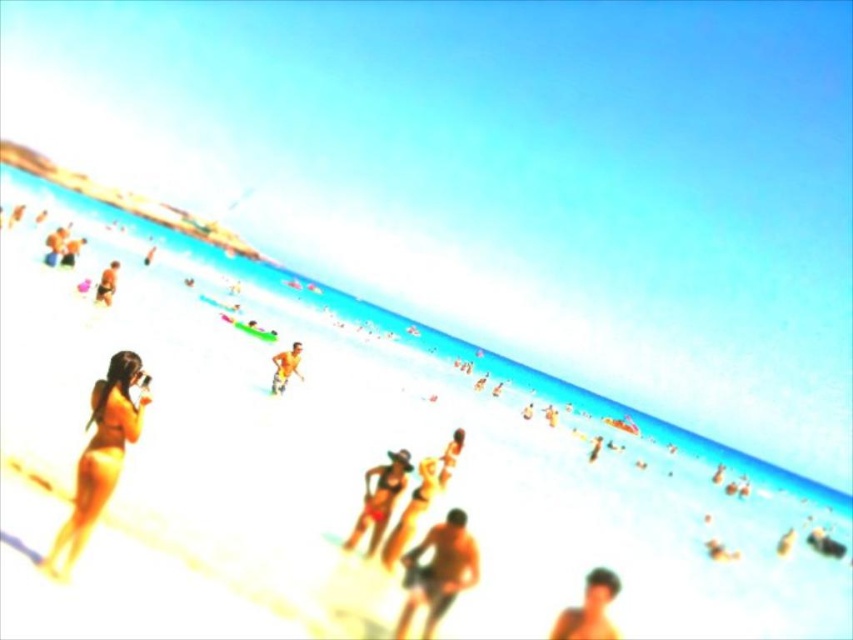
Question: Does matte skin at center have a greater width compared to matte bikini at center?

Choices:
 (A) yes
 (B) no

Answer: (B)

Question: Is matte yellow bikini at left positioned before matte bikini at center?

Choices:
 (A) yes
 (B) no

Answer: (A)

Question: Based on their relative distances, which object is nearer to the smooth tan skin at lower right?

Choices:
 (A) matte skin at center
 (B) matte bikini at center

Answer: (A)

Question: Which object is positioned closest to the smooth tan skin at center?

Choices:
 (A) smooth tan skin at lower right
 (B) matte bikini at center
 (C) matte skin at center
 (D) matte black swimsuit at upper left

Answer: (D)

Question: Which object is the closest to the matte skin at center?

Choices:
 (A) smooth tan skin at lower right
 (B) matte black bikini at center

Answer: (B)

Question: Observing the image, what is the correct spatial positioning of matte black bikini at center in reference to smooth tan skin at center?

Choices:
 (A) below
 (B) above

Answer: (A)